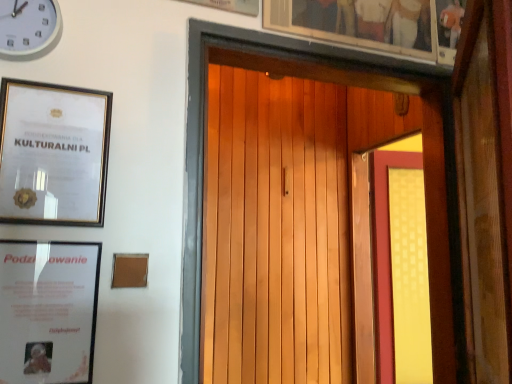
Question: From a real-world perspective, relative to wooden picture frame at upper center, the first picture frame viewed from the top, is matte white picture frame at lower left, the first picture frame from the bottom, vertically above or below?

Choices:
 (A) above
 (B) below

Answer: (B)

Question: From their relative heights in the image, would you say matte white picture frame at lower left, which ranks as the fourth picture frame in top-to-bottom order, is taller or shorter than wooden picture frame at upper center, the 4th picture frame from the bottom?

Choices:
 (A) short
 (B) tall

Answer: (A)

Question: Which object is positioned closest to the matte white picture frame at lower left, the first picture frame from the bottom?

Choices:
 (A) yellow matte screen door at right
 (B) wooden picture frame at upper center, the first picture frame viewed from the top
 (C) gold-framed certificate at upper left, placed as the 3th picture frame when sorted from top to bottom
 (D) wooden door at center
 (E) white plastic clock at upper left

Answer: (C)

Question: Which object is the farthest from the gold-framed certificate at upper left, placed as the 3th picture frame when sorted from top to bottom?

Choices:
 (A) matte white picture frame at lower left, which ranks as the fourth picture frame in top-to-bottom order
 (B) wooden picture frame at upper center, the 4th picture frame positioned from the left
 (C) wooden picture frame at upper center, the first picture frame viewed from the top
 (D) yellow matte screen door at right
 (E) white plastic clock at upper left

Answer: (D)